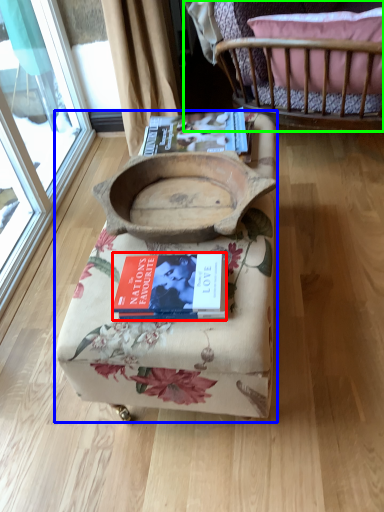
Question: Estimate the real-world distances between objects in this image. Which object is farther from book (highlighted by a red box), furniture (highlighted by a blue box) or furniture (highlighted by a green box)?

Choices:
 (A) furniture
 (B) furniture

Answer: (B)